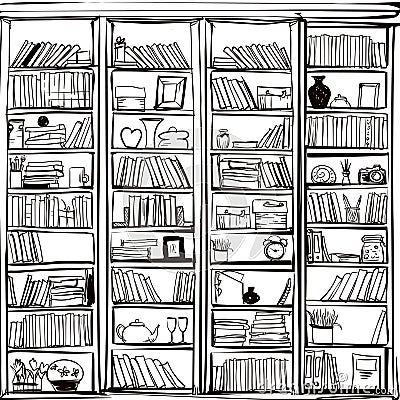
Find the location of a particular element. The width and height of the screenshot is (400, 400). bookshelves is located at coordinates pyautogui.click(x=53, y=213), pyautogui.click(x=150, y=211), pyautogui.click(x=250, y=206), pyautogui.click(x=336, y=198).